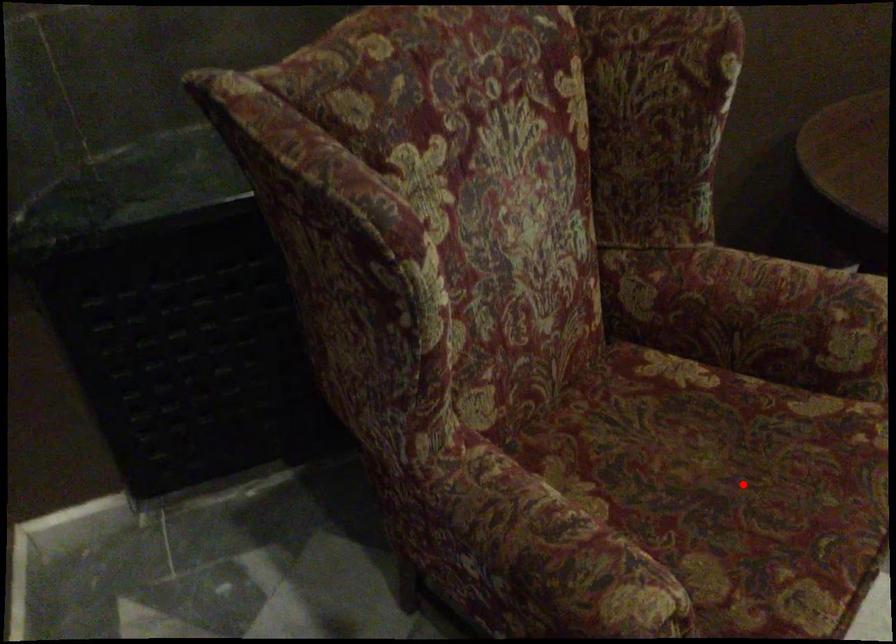
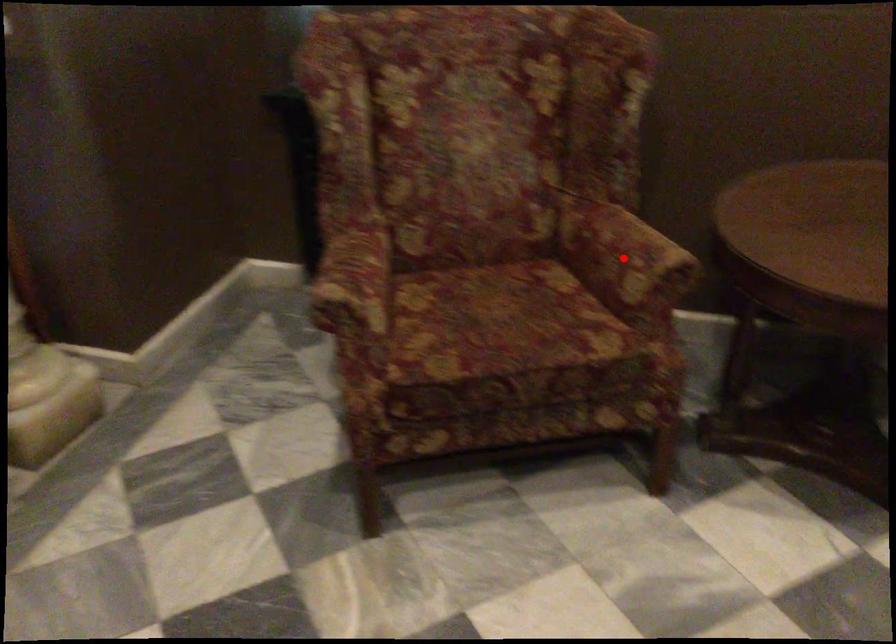
I am providing you with two images of the same scene from different viewpoints. A red point is marked on the first image and another point is marked on the second image. Is the marked point in image1 the same physical position as the marked point in image2?

No